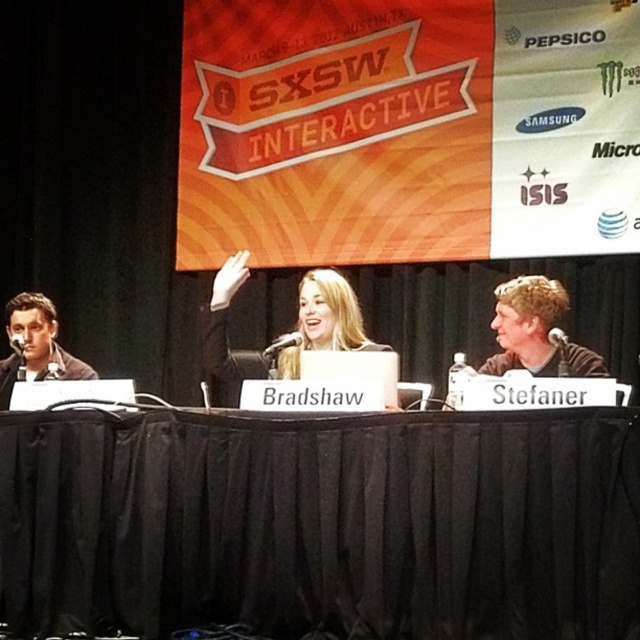
You are attending the SXSW Interactive event and see the black fabric table at center and the matte black jacket at left. Which object is located to the left of the other?

The matte black jacket at left is located to the left of the black fabric table at center.

You are a photographer positioned behind the SXSW banner. You want to take a photo of the person with blonde hair at center and the Bradshaw nameplate. How far apart should you position them in the frame?

The person with blonde hair at center and the Bradshaw nameplate are 3.44 meters apart, so you should position them that distance apart in the frame.